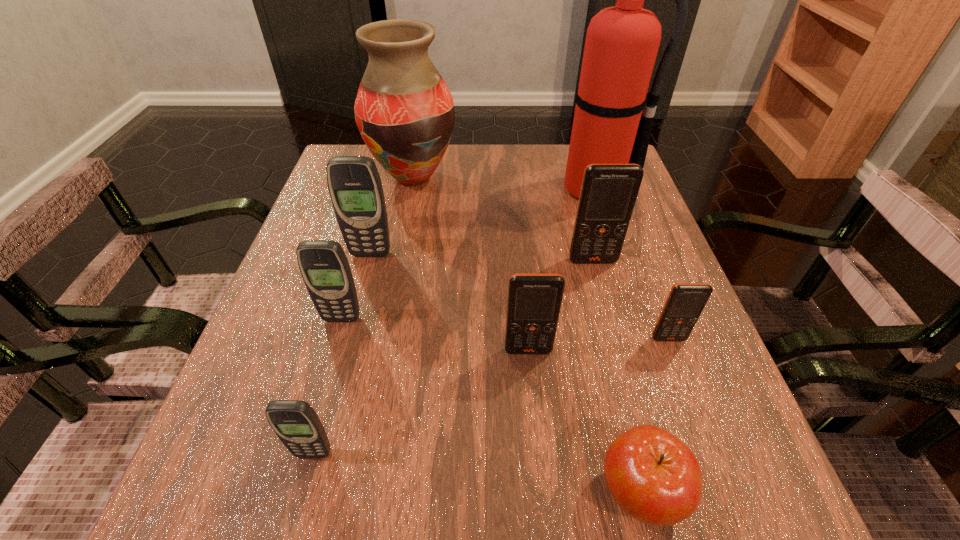
You are a GUI agent. You are given a task and a screenshot of the screen. Output one action in this format:
    pyautogui.click(x=<x>, y=<y>)
    Task: Click on the rightmost cellular telephone
    Image resolution: width=960 pixels, height=540 pixels.
    Given the screenshot: What is the action you would take?
    tap(686, 301)

Locate an element on the screen. This screenshot has height=540, width=960. the fourth farthest cellular telephone is located at coordinates (686, 301).

Find the location of a particular element. the nearest cellular telephone is located at coordinates (295, 422).

This screenshot has height=540, width=960. Identify the location of the nearest gray cellular telephone. (295, 422).

You are a GUI agent. You are given a task and a screenshot of the screen. Output one action in this format:
    pyautogui.click(x=<x>, y=<y>)
    Task: Click on the vacant region located at the nozzle of the red fire extinguisher
    
    Given the screenshot: What is the action you would take?
    pyautogui.click(x=607, y=227)

The height and width of the screenshot is (540, 960). I want to click on vacant space located 0.060m on the back of the vase, so click(420, 144).

Where is `vacant region located 0.120m on the screen of the second cellular telephone from right to left`? The width and height of the screenshot is (960, 540). vacant region located 0.120m on the screen of the second cellular telephone from right to left is located at coordinates (606, 309).

This screenshot has width=960, height=540. Identify the location of free region located 0.340m on the screen of the biggest gray cellular telephone. (331, 407).

At what (x,y) coordinates should I click in order to perform the action: click on vacant space located 0.140m on the screen of the fifth farthest object. Please return your answer as a coordinate pair (x, y). The image size is (960, 540). Looking at the image, I should click on (321, 392).

Image resolution: width=960 pixels, height=540 pixels. What are the coordinates of `vacant region located 0.210m on the screen of the leftmost orange cellular telephone` in the screenshot? It's located at click(541, 485).